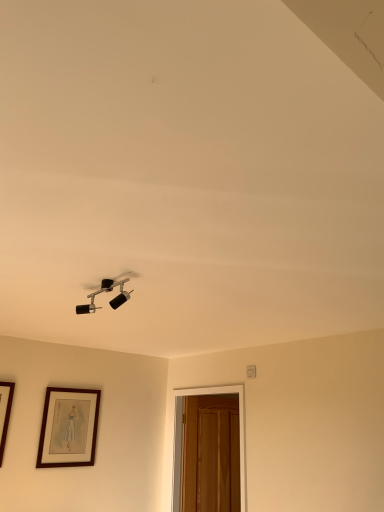
The width and height of the screenshot is (384, 512). I want to click on matte black light fixture at upper center, so click(106, 291).

Locate an element on the screen. brown wooden picture frame at lower left is located at coordinates (69, 428).

Locate an element on the screen. The width and height of the screenshot is (384, 512). wooden door at lower right is located at coordinates (239, 423).

Where is `matte black light fixture at upper center`? matte black light fixture at upper center is located at coordinates (106, 291).

Locate an element on the screen. Image resolution: width=384 pixels, height=512 pixels. lamp on the left of wooden door at lower right is located at coordinates (106, 291).

Can you confirm if matte black light fixture at upper center is thinner than wooden door at lower right?

No, matte black light fixture at upper center is not thinner than wooden door at lower right.

Are matte black light fixture at upper center and wooden door at lower right far apart?

matte black light fixture at upper center is far away from wooden door at lower right.

Who is smaller, matte black light fixture at upper center or wooden door at lower right?

matte black light fixture at upper center is smaller.

How many degrees apart are the facing directions of wooden door at lower right and brown wooden picture frame at lower left?

The facing directions of wooden door at lower right and brown wooden picture frame at lower left are 85.2 degrees apart.

Is wooden door at lower right wider or thinner than brown wooden picture frame at lower left?

wooden door at lower right is wider than brown wooden picture frame at lower left.

Measure the distance from wooden door at lower right to brown wooden picture frame at lower left.

wooden door at lower right is 37.23 inches from brown wooden picture frame at lower left.

Is wooden door at lower right inside or outside of brown wooden picture frame at lower left?

wooden door at lower right cannot be found inside brown wooden picture frame at lower left.

How many degrees apart are the facing directions of wooden door at lower right and matte black light fixture at upper center?

The angle between the facing direction of wooden door at lower right and the facing direction of matte black light fixture at upper center is 1.08 degrees.

Between wooden door at lower right and matte black light fixture at upper center, which one has less height?

matte black light fixture at upper center.

Where is `glass door below the matte black light fixture at upper center (from a real-world perspective)`? glass door below the matte black light fixture at upper center (from a real-world perspective) is located at coordinates (239, 423).

Looking at the image, does wooden door at lower right seem bigger or smaller compared to matte black light fixture at upper center?

In the image, wooden door at lower right appears to be larger than matte black light fixture at upper center.

Is brown wooden picture frame at lower left turned away from wooden door at lower right?

brown wooden picture frame at lower left does not have its back to wooden door at lower right.

In the scene shown: From the image's perspective, between brown wooden picture frame at lower left and wooden door at lower right, which one is located above?

From the image's view, brown wooden picture frame at lower left is above.

Looking at this image, which is more to the left, brown wooden picture frame at lower left or wooden door at lower right?

brown wooden picture frame at lower left.

Looking at this image, is brown wooden picture frame at lower left inside the boundaries of wooden door at lower right, or outside?

brown wooden picture frame at lower left is outside wooden door at lower right.

Between matte black light fixture at upper center and brown wooden picture frame at lower left, which one is positioned behind?

brown wooden picture frame at lower left is more distant.

Considering the positions of points (117, 304) and (85, 417), is point (117, 304) farther from camera compared to point (85, 417)?

No, (117, 304) is closer to viewer.

Which of these two, matte black light fixture at upper center or brown wooden picture frame at lower left, stands shorter?

matte black light fixture at upper center.

From the image's perspective, which is above, matte black light fixture at upper center or brown wooden picture frame at lower left?

matte black light fixture at upper center appears higher in the image.

From a real-world perspective, is brown wooden picture frame at lower left on top of matte black light fixture at upper center?

Actually, brown wooden picture frame at lower left is physically below matte black light fixture at upper center in the real world.

Is brown wooden picture frame at lower left outside of matte black light fixture at upper center?

brown wooden picture frame at lower left lies outside matte black light fixture at upper center's area.

Identify the location of picture frame located on the left of matte black light fixture at upper center. (69, 428).

Locate an element on the screen. Image resolution: width=384 pixels, height=512 pixels. glass door on the right of matte black light fixture at upper center is located at coordinates coord(239,423).

I want to click on glass door lying below the brown wooden picture frame at lower left (from the image's perspective), so click(x=239, y=423).

When comparing their distances from wooden door at lower right, does matte black light fixture at upper center or brown wooden picture frame at lower left seem further?

matte black light fixture at upper center is further to wooden door at lower right.

Consider the image. When comparing their distances from brown wooden picture frame at lower left, does matte black light fixture at upper center or wooden door at lower right seem further?

matte black light fixture at upper center.

Estimate the real-world distances between objects in this image. Which object is closer to brown wooden picture frame at lower left, wooden door at lower right or matte black light fixture at upper center?

The object closer to brown wooden picture frame at lower left is wooden door at lower right.

When comparing their distances from matte black light fixture at upper center, does brown wooden picture frame at lower left or wooden door at lower right seem closer?

Among the two, brown wooden picture frame at lower left is located nearer to matte black light fixture at upper center.

Considering their positions, is wooden door at lower right positioned further to matte black light fixture at upper center than brown wooden picture frame at lower left?

The object further to matte black light fixture at upper center is wooden door at lower right.

Which object lies further to the anchor point wooden door at lower right, brown wooden picture frame at lower left or matte black light fixture at upper center?

matte black light fixture at upper center is further to wooden door at lower right.

In order to click on glass door between matte black light fixture at upper center and brown wooden picture frame at lower left along the z-axis in this screenshot , I will do `click(239, 423)`.